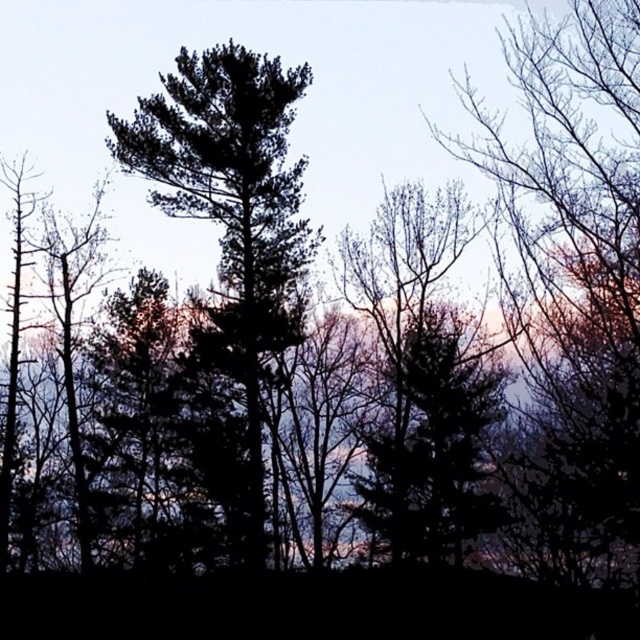
You are a bird looking for a nesting spot. You see the silvery bark tree at right and the dark green textured tree at center. Which tree would you choose if you prefer nesting in taller trees?

The silvery bark tree at right is much taller than the dark green textured tree at center, so you should choose the silvery bark tree at right for nesting.

You are an environmental scientist studying tree sizes in this forest. You observe the silvery bark tree at right and the dark green textured tree at center. Which tree has a larger physical size according to your measurements?

The silvery bark tree at right is bigger than the dark green textured tree at center, so it has a larger physical size.

You are an environmental scientist observing the forest. You need to determine which tree is taller between the silvery bark tree at right and the green leafy tree at center. Based on the scene, which one is taller?

The green leafy tree at center is taller than the silvery bark tree at right.